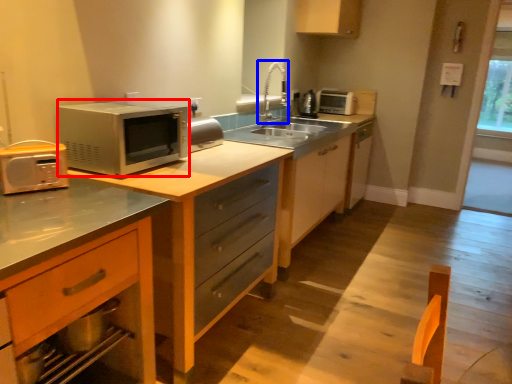
Question: Which object is closer to the camera taking this photo, microwave oven (highlighted by a red box) or faucet (highlighted by a blue box)?

Choices:
 (A) microwave oven
 (B) faucet

Answer: (A)